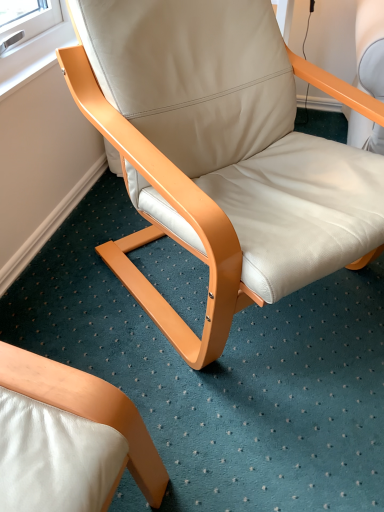
Question: Should I look upward or downward to see beige leather chair at center?

Choices:
 (A) down
 (B) up

Answer: (B)